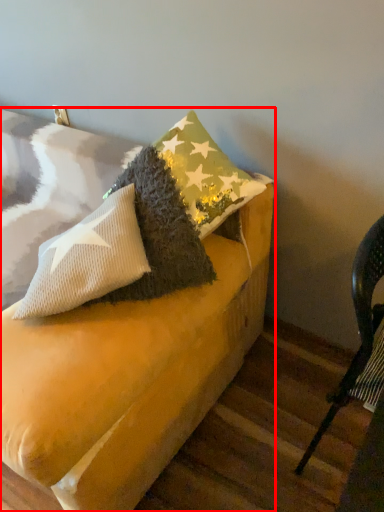
Question: In this image, where is furniture (annotated by the red box) located relative to chair?

Choices:
 (A) left
 (B) right

Answer: (A)